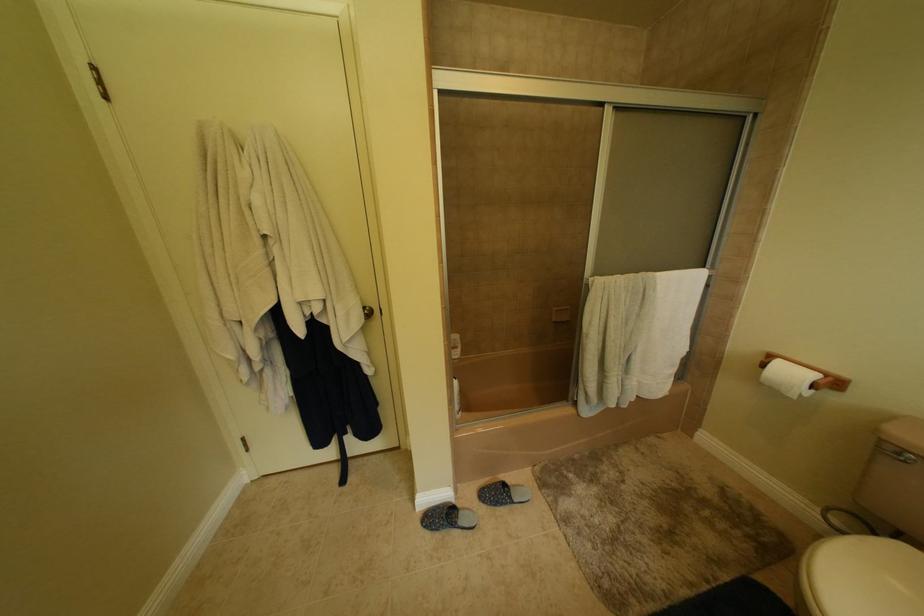
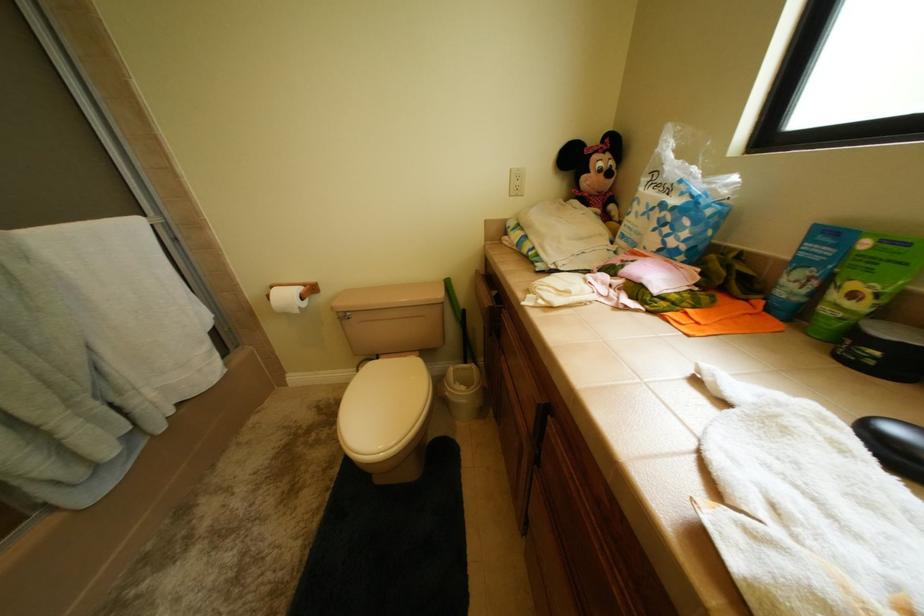
In the scene shown: The images are taken continuously from a first-person perspective. In which direction is your viewpoint rotating?

The rotation direction of the camera is right-down.